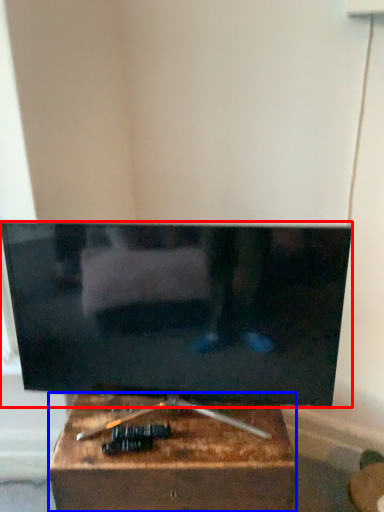
Question: Among these objects, which one is farthest to the camera, television (highlighted by a red box) or furniture (highlighted by a blue box)?

Choices:
 (A) television
 (B) furniture

Answer: (B)